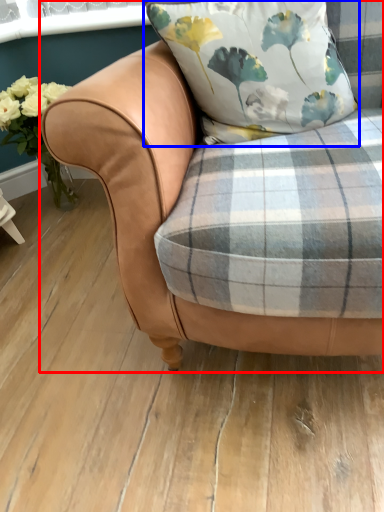
Question: Among these objects, which one is farthest to the camera, chair (highlighted by a red box) or pillow (highlighted by a blue box)?

Choices:
 (A) chair
 (B) pillow

Answer: (B)